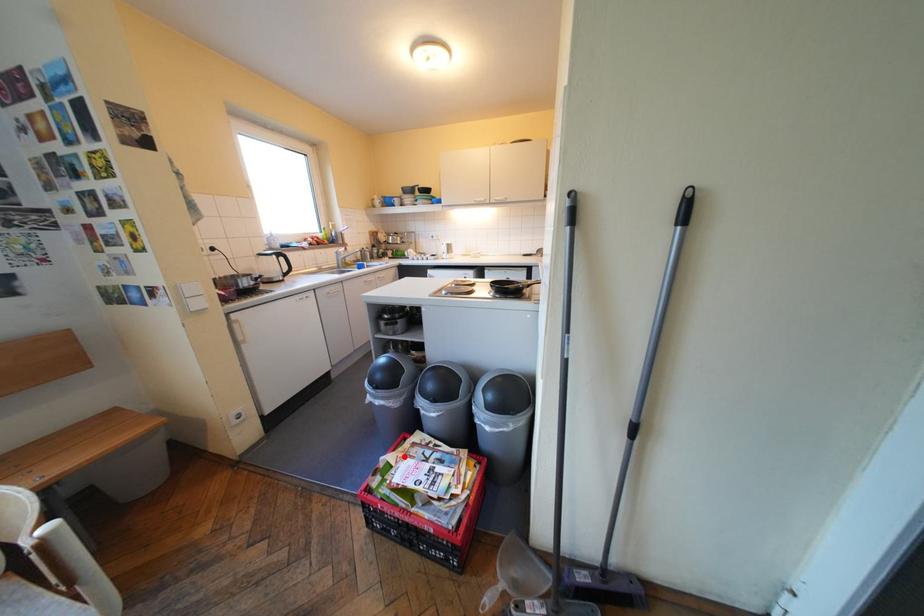
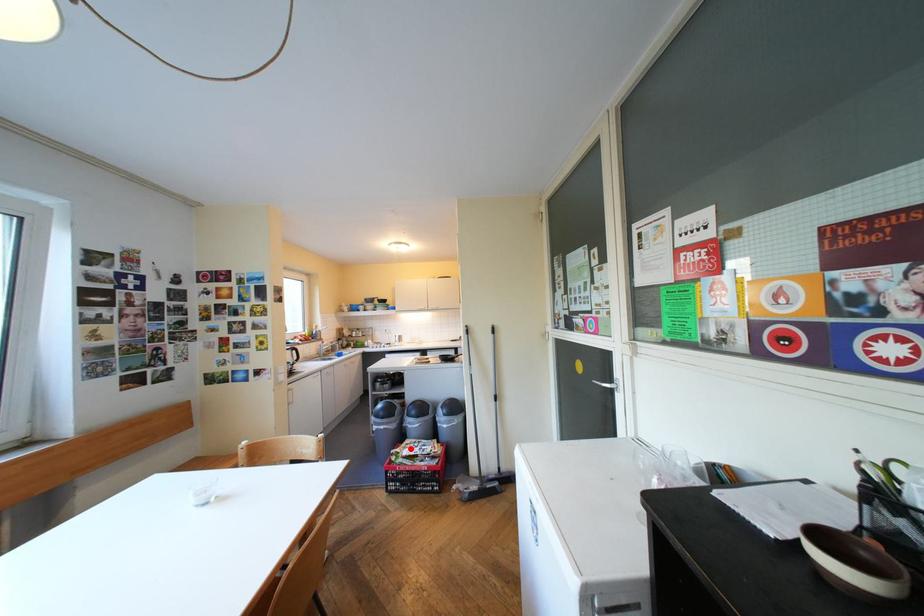
I am providing you with two images of the same scene from different viewpoints. A red point is marked on the first image and another point is marked on the second image. Does the point marked in image1 correspond to the same location as the one in image2?

Yes